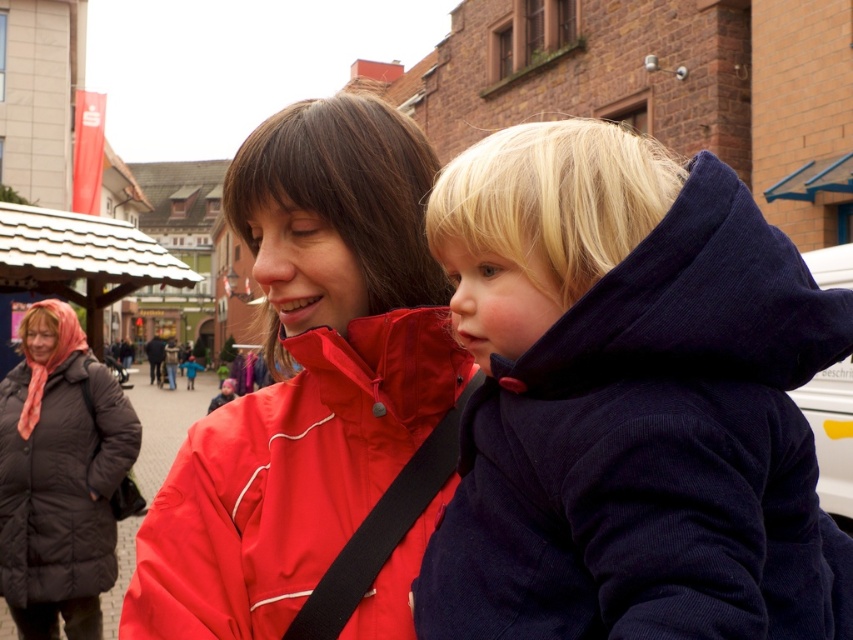
Based on the scene description, what object is located at the coordinates point (630, 401)?

The navy corduroy jacket at center is located at point (630, 401).

Consider the image. Based on the scene description, can you determine which object is wider between the navy corduroy jacket at center and the black puffy coat at lower left?

The navy corduroy jacket at center is wider than the black puffy coat at lower left according to the description.